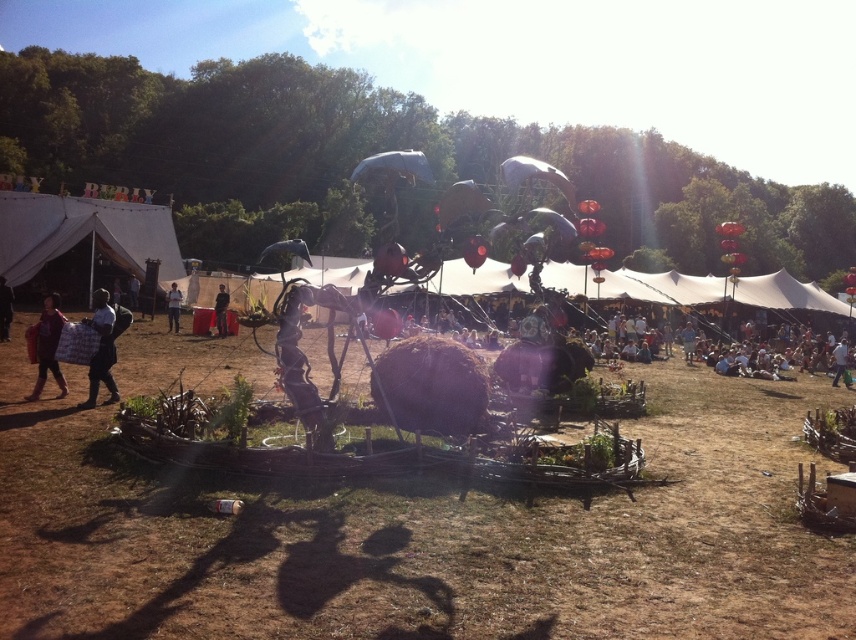
This screenshot has height=640, width=856. What do you see at coordinates (102, 348) in the screenshot?
I see `black fabric at left` at bounding box center [102, 348].

Does black fabric at left have a lesser height compared to light blue fabric at center?

No, black fabric at left is not shorter than light blue fabric at center.

Between point (93, 397) and point (171, 291), which one is positioned in front?

Point (93, 397) is more forward.

Identify the location of black fabric at left. Image resolution: width=856 pixels, height=640 pixels. (102, 348).

Is point (107, 253) in front of point (0, 298)?

No, it is behind (0, 298).

Who is more forward, (x=128, y=257) or (x=4, y=316)?

Positioned in front is point (x=4, y=316).

You are a GUI agent. You are given a task and a screenshot of the screen. Output one action in this format:
    pyautogui.click(x=<x>, y=<y>)
    Task: Click on the white canvas tent at upper left
    
    Given the screenshot: What is the action you would take?
    pyautogui.click(x=84, y=234)

Which is more to the left, matte red bag at lower left or white fabric person at lower right?

matte red bag at lower left

What are the coordinates of `matte red bag at lower left` in the screenshot? It's located at (46, 346).